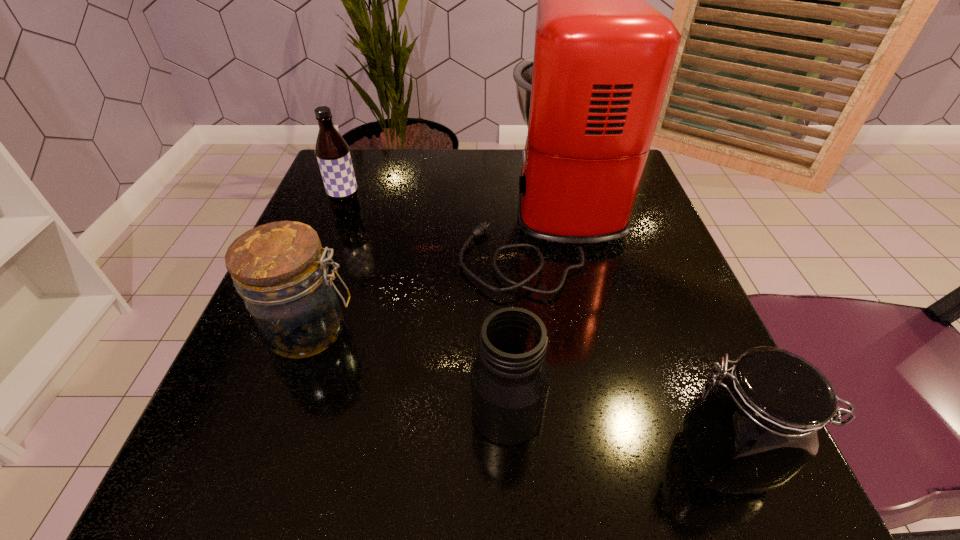
Locate an element on the screen. This screenshot has height=540, width=960. jar that is the second closest to the farthest jar is located at coordinates (752, 430).

This screenshot has width=960, height=540. Find the location of `free space that satisfies the following two spatial constraints: 1. on the lid of the leftmost jar; 2. on the right side of the second jar from right to left`. free space that satisfies the following two spatial constraints: 1. on the lid of the leftmost jar; 2. on the right side of the second jar from right to left is located at coordinates (282, 412).

The height and width of the screenshot is (540, 960). In order to click on free location that satisfies the following two spatial constraints: 1. on the lid of the farthest jar; 2. on the left side of the second jar from left to right in this screenshot , I will do `click(282, 412)`.